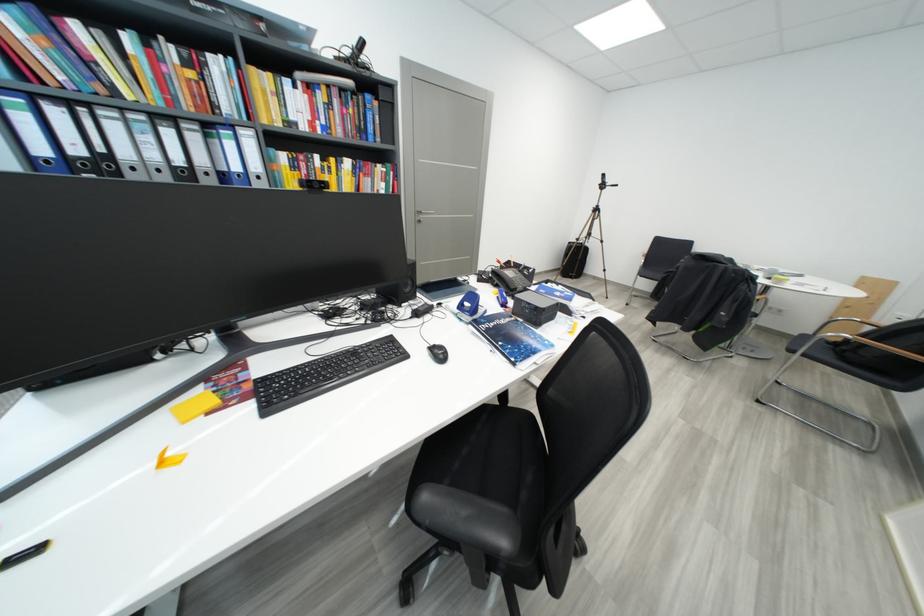
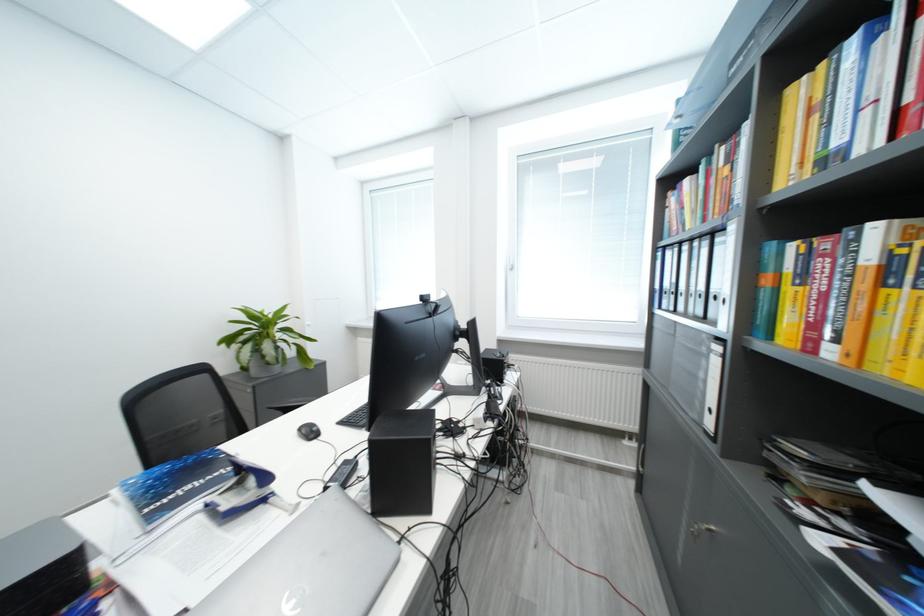
In the second image, find the point that corresponds to the point at 296,84 in the first image.

(861, 44)